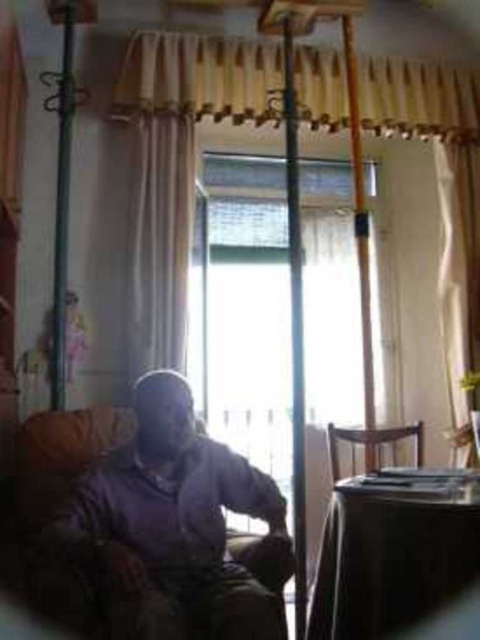
Question: Which of the following is the farthest from the observer?

Choices:
 (A) (299, 61)
 (B) (350, 436)

Answer: (A)

Question: Can you confirm if matte purple sweater at center is thinner than brown wooden chair at lower right?

Choices:
 (A) yes
 (B) no

Answer: (B)

Question: Considering the real-world distances, which object is farthest from the brown wooden chair at lower right?

Choices:
 (A) matte purple sweater at center
 (B) beige textured curtain at center

Answer: (B)

Question: Does matte purple sweater at center have a lesser width compared to beige textured curtain at center?

Choices:
 (A) yes
 (B) no

Answer: (A)

Question: Can you confirm if beige textured curtain at center is positioned below brown wooden chair at lower right?

Choices:
 (A) no
 (B) yes

Answer: (A)

Question: Estimate the real-world distances between objects in this image. Which object is closer to the matte purple sweater at center?

Choices:
 (A) brown wooden chair at lower right
 (B) beige textured curtain at center

Answer: (A)